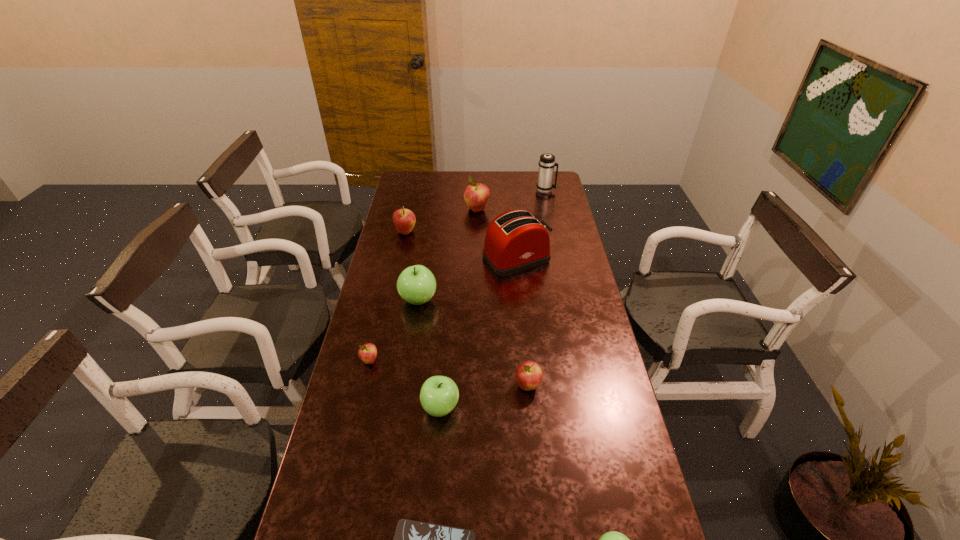
This screenshot has width=960, height=540. I want to click on the rightmost red apple, so click(x=529, y=375).

At what (x,y) coordinates should I click in order to perform the action: click on the second apple from right to left. Please return your answer as a coordinate pair (x, y). The width and height of the screenshot is (960, 540). Looking at the image, I should click on (529, 375).

I want to click on the smallest red apple, so click(x=367, y=353).

This screenshot has height=540, width=960. Identify the location of the fourth farthest apple. (367, 353).

Locate an element on the screen. vacant space located on the left of the toaster is located at coordinates (464, 259).

Where is `vacant position located 0.290m on the right of the farthest apple`? Image resolution: width=960 pixels, height=540 pixels. vacant position located 0.290m on the right of the farthest apple is located at coordinates [550, 210].

You are a GUI agent. You are given a task and a screenshot of the screen. Output one action in this format:
    pyautogui.click(x=<x>, y=<y>)
    Task: Click on the free space located on the back of the third nearest red apple
    The width and height of the screenshot is (960, 540).
    Given the screenshot: What is the action you would take?
    pyautogui.click(x=413, y=200)

Where is `free location located 0.360m on the back of the farthest green apple`? Image resolution: width=960 pixels, height=540 pixels. free location located 0.360m on the back of the farthest green apple is located at coordinates (428, 233).

Identify the location of vacant region located 0.180m on the front of the second biggest green apple. (435, 489).

This screenshot has height=540, width=960. In order to click on vacant space situated on the front of the sixth apple from left to right in this screenshot , I will do `click(540, 508)`.